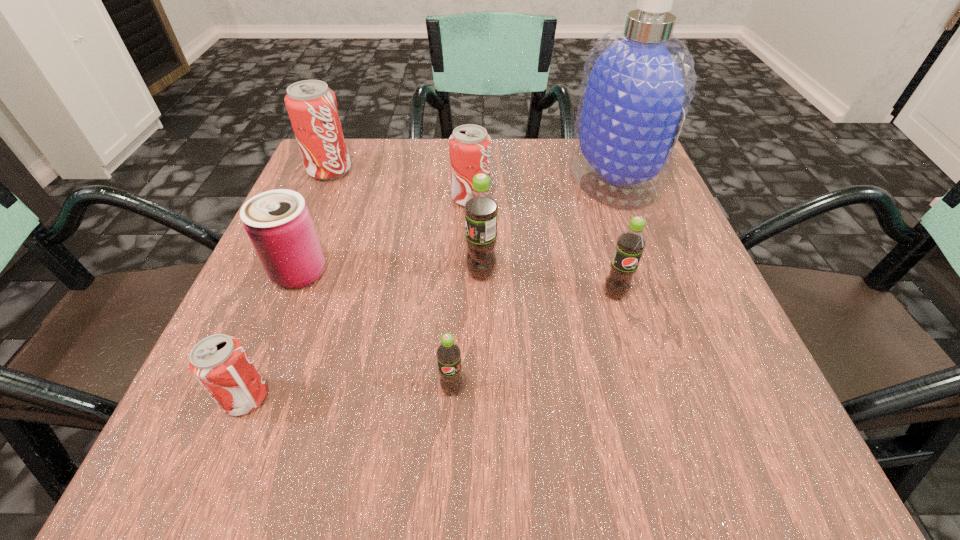
Find the location of a particular element. The width and height of the screenshot is (960, 540). vacant area located 0.060m on the front label of the smallest green soda is located at coordinates (449, 442).

This screenshot has height=540, width=960. Find the location of `cleansing agent situated at the far edge`. cleansing agent situated at the far edge is located at coordinates [638, 82].

The image size is (960, 540). I want to click on object that is at the near edge, so click(x=219, y=362).

I want to click on can situated at the left edge, so click(x=278, y=222).

Identify the location of cleansing agent located in the right edge section of the desktop. The image size is (960, 540). 638,82.

The width and height of the screenshot is (960, 540). I want to click on soda present at the right edge, so click(x=630, y=244).

Locate an element on the screen. The height and width of the screenshot is (540, 960). object present at the far left corner is located at coordinates (312, 107).

The width and height of the screenshot is (960, 540). Find the location of `object that is at the near left corner`. object that is at the near left corner is located at coordinates (219, 362).

Image resolution: width=960 pixels, height=540 pixels. I want to click on object located at the far right corner, so click(x=638, y=82).

At what (x,y) coordinates should I click in order to perform the action: click on free location at the far edge of the desktop. Please return your answer as a coordinate pair (x, y). Image resolution: width=960 pixels, height=540 pixels. Looking at the image, I should click on (396, 178).